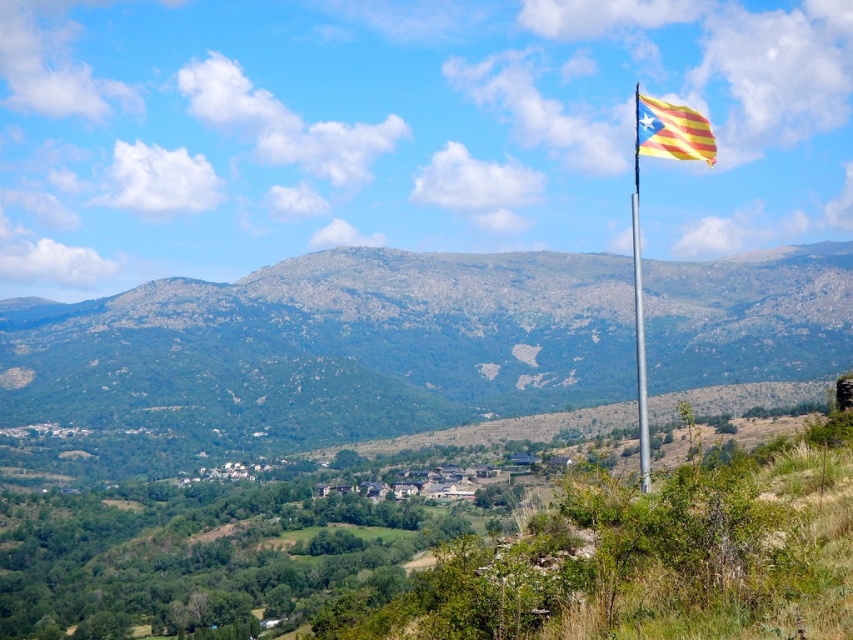
Between green rocky mountain at center and yellow striped fabric at upper right, which one appears on the left side from the viewer's perspective?

green rocky mountain at center

Based on the photo, who is taller, green rocky mountain at center or yellow striped fabric at upper right?

yellow striped fabric at upper right is taller.

Does point (585, 332) lie behind point (701, 148)?

That is True.

You are a GUI agent. You are given a task and a screenshot of the screen. Output one action in this format:
    pyautogui.click(x=<x>, y=<y>)
    Task: Click on the green rocky mountain at center
    
    Given the screenshot: What is the action you would take?
    pyautogui.click(x=318, y=353)